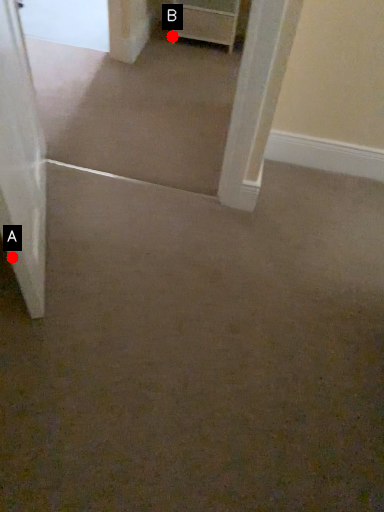
Question: Two points are circled on the image, labeled by A and B beside each circle. Which point is closer to the camera?

Choices:
 (A) A is closer
 (B) B is closer

Answer: (A)